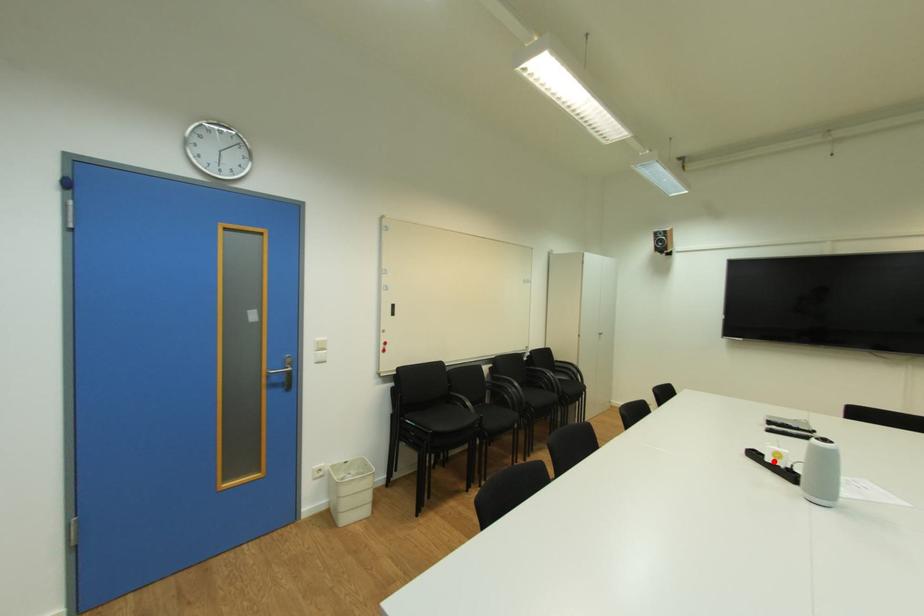
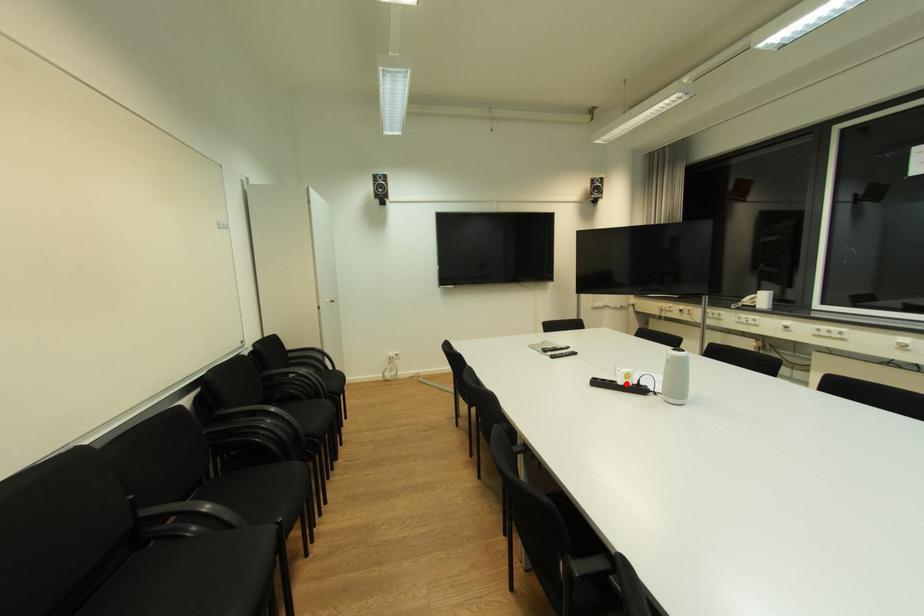
I am providing you with two images of the same scene from different viewpoints. A red point is marked on the first image and another point is marked on the second image. Do the highlighted points in image1 and image2 indicate the same real-world spot?

Yes